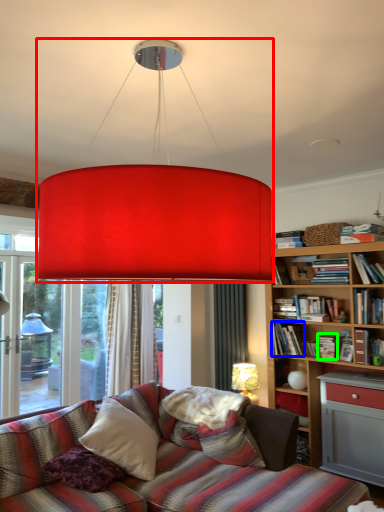
Question: Which object is the closest to the lamp (highlighted by a red box)? Choose among these: book (highlighted by a blue box) or book (highlighted by a green box).

Choices:
 (A) book
 (B) book

Answer: (A)